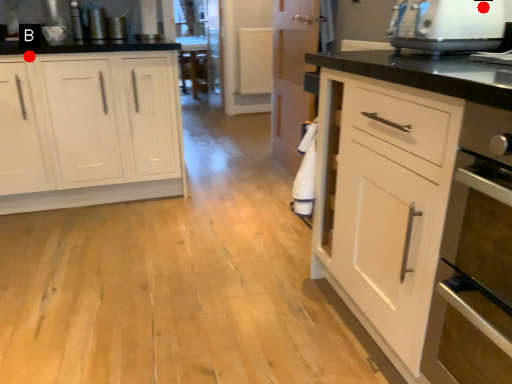
Question: Two points are circled on the image, labeled by A and B beside each circle. Which point is closer to the camera?

Choices:
 (A) A is closer
 (B) B is closer

Answer: (A)